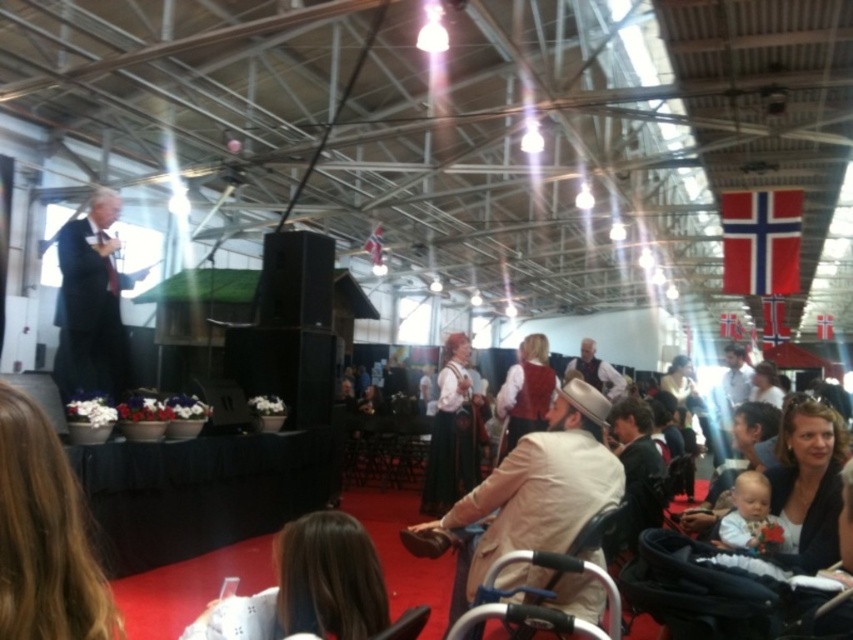
Looking at this image, does brown hair at lower center have a smaller size compared to matte black jacket at lower right?

Indeed, brown hair at lower center has a smaller size compared to matte black jacket at lower right.

This screenshot has width=853, height=640. Identify the location of brown hair at lower center. (306, 588).

This screenshot has height=640, width=853. I want to click on brown hair at lower center, so click(x=306, y=588).

Is dark suit at left to the right of velvet red vest at center from the viewer's perspective?

No, dark suit at left is not to the right of velvet red vest at center.

Between point (120, 397) and point (544, 387), which one is positioned behind?

Point (544, 387)

Does point (83, 253) come behind point (527, 348)?

No, (83, 253) is closer to viewer.

This screenshot has height=640, width=853. I want to click on dark suit at left, so click(x=91, y=305).

Which is below, matte white blouse at center or white soft baby at lower right?

matte white blouse at center is below.

Is point (474, 435) behind point (753, 490)?

Yes.

Where is `matte white blouse at center`? The image size is (853, 640). matte white blouse at center is located at coordinates (451, 433).